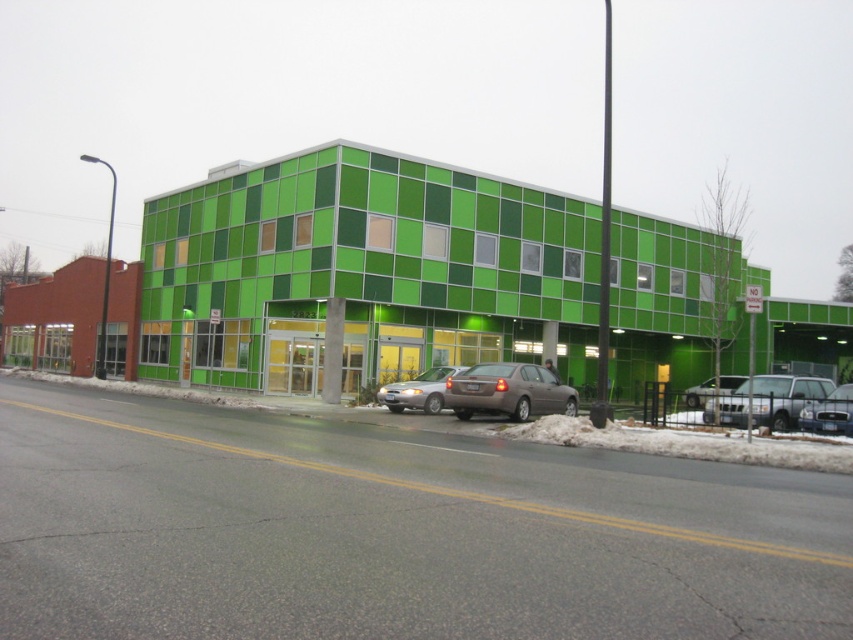
Question: Among these objects, which one is nearest to the camera?

Choices:
 (A) matte silver sedan at center
 (B) silver metallic sedan at right
 (C) matte gray sedan at center

Answer: (B)

Question: Considering the real-world distances, which object is farthest from the silver metallic sedan at right?

Choices:
 (A) shiny silver sedan at center
 (B) satin silver sedan at center

Answer: (B)

Question: Can you confirm if satin silver sedan at center is positioned below matte silver sedan at center?

Choices:
 (A) no
 (B) yes

Answer: (A)

Question: Does matte gray sedan at center lie in front of shiny silver sedan at center?

Choices:
 (A) yes
 (B) no

Answer: (B)

Question: Which object is positioned closest to the satin silver sedan at center?

Choices:
 (A) matte silver sedan at center
 (B) matte gray sedan at center

Answer: (B)

Question: Does satin silver sedan at center appear on the left side of shiny silver sedan at center?

Choices:
 (A) yes
 (B) no

Answer: (A)